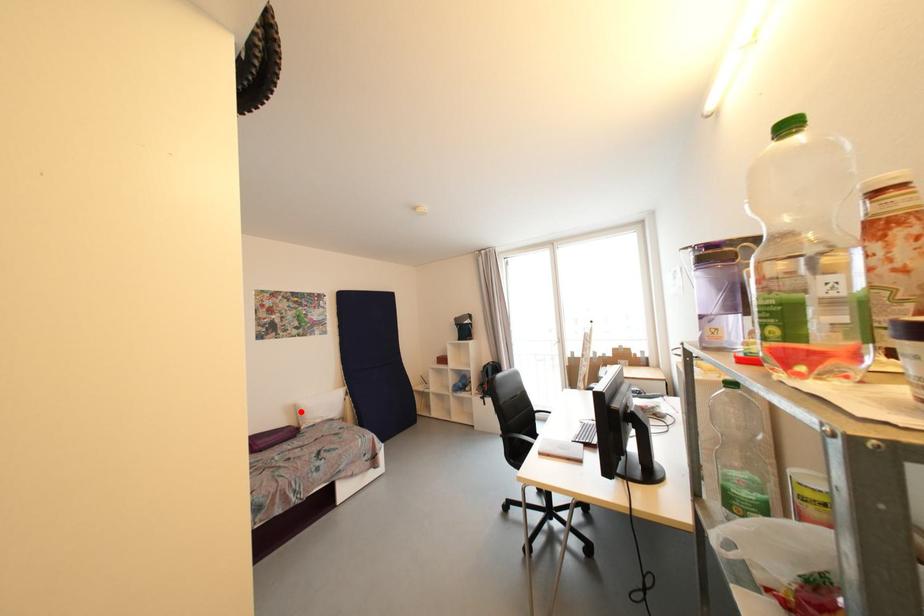
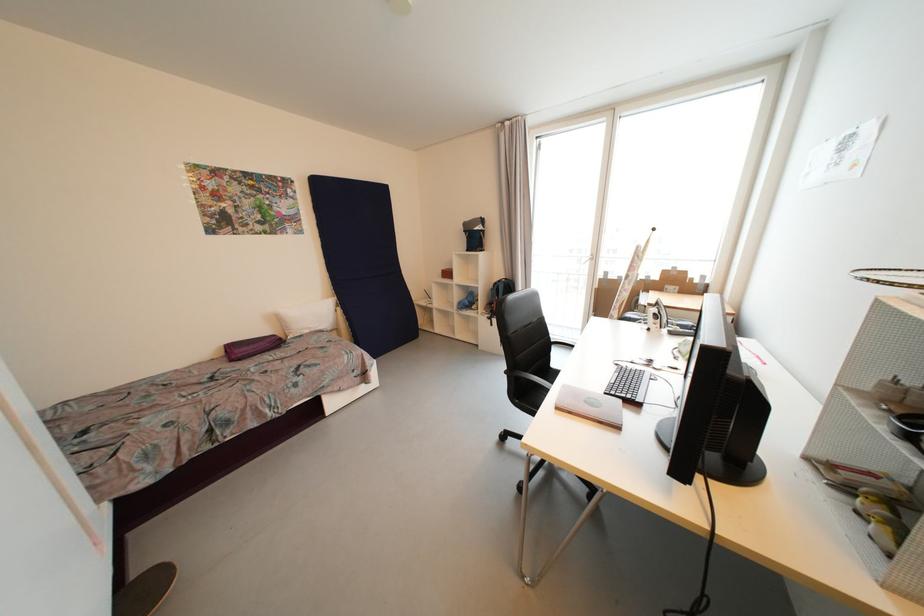
Question: I am providing you with two images of the same scene from different viewpoints. In image1, a red point is highlighted. Considering the same 3D point in image2, which of the following is correct?

Choices:
 (A) It is closer
 (B) It is farther

Answer: (A)